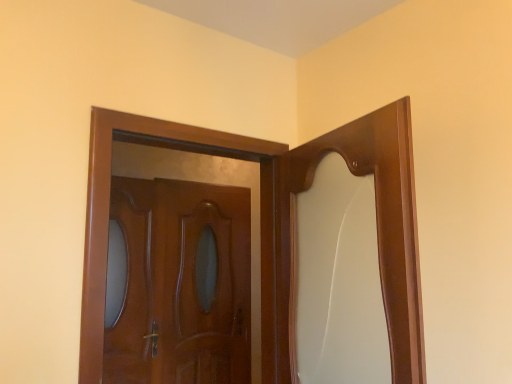
Question: Which direction should I rotate to face glossy wood door at center, which is the second door from front to back, — up or down?

Choices:
 (A) down
 (B) up

Answer: (A)

Question: Is glossy wood door at center, the 2th door positioned from the back, further to the viewer compared to glossy wood door at center, which is counted as the 1th door, starting from the back?

Choices:
 (A) yes
 (B) no

Answer: (B)

Question: From a real-world perspective, is glossy wood door at center, marked as the 1th door in a front-to-back arrangement, below glossy wood door at center, which is the second door from front to back?

Choices:
 (A) no
 (B) yes

Answer: (A)

Question: Is glossy wood door at center, marked as the 1th door in a front-to-back arrangement, facing away from glossy wood door at center, which is the second door from front to back?

Choices:
 (A) yes
 (B) no

Answer: (A)

Question: Is glossy wood door at center, the 2th door positioned from the back, at the left side of glossy wood door at center, which is counted as the 1th door, starting from the back?

Choices:
 (A) yes
 (B) no

Answer: (B)

Question: From the image's perspective, would you say glossy wood door at center, marked as the 1th door in a front-to-back arrangement, is shown under glossy wood door at center, which is counted as the 1th door, starting from the back?

Choices:
 (A) no
 (B) yes

Answer: (A)

Question: Does glossy wood door at center, the 2th door positioned from the back, turn towards glossy wood door at center, which is the second door from front to back?

Choices:
 (A) yes
 (B) no

Answer: (B)

Question: Is glossy wood door at center, which is counted as the 1th door, starting from the back, not near glossy wood door at center, marked as the 1th door in a front-to-back arrangement?

Choices:
 (A) no
 (B) yes

Answer: (B)

Question: Is glossy wood door at center, which is the second door from front to back, not inside glossy wood door at center, marked as the 1th door in a front-to-back arrangement?

Choices:
 (A) yes
 (B) no

Answer: (A)

Question: From the image's perspective, does glossy wood door at center, which is the second door from front to back, appear lower than glossy wood door at center, the 2th door positioned from the back?

Choices:
 (A) no
 (B) yes

Answer: (B)

Question: Can you confirm if glossy wood door at center, which is the second door from front to back, is positioned to the right of glossy wood door at center, marked as the 1th door in a front-to-back arrangement?

Choices:
 (A) no
 (B) yes

Answer: (A)

Question: From the image's perspective, is glossy wood door at center, which is counted as the 1th door, starting from the back, over glossy wood door at center, the 2th door positioned from the back?

Choices:
 (A) no
 (B) yes

Answer: (A)

Question: Is glossy wood door at center, which is the second door from front to back, behind glossy wood door at center, marked as the 1th door in a front-to-back arrangement?

Choices:
 (A) yes
 (B) no

Answer: (A)

Question: Looking at the image, does glossy wood door at center, which is counted as the 1th door, starting from the back, seem bigger or smaller compared to glossy wood door at center, marked as the 1th door in a front-to-back arrangement?

Choices:
 (A) small
 (B) big

Answer: (A)